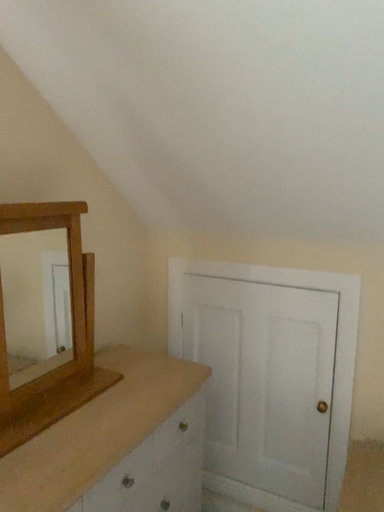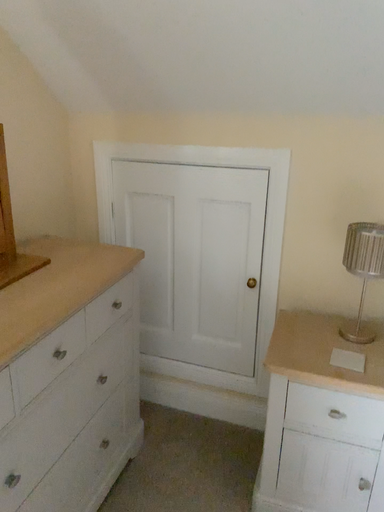
Question: How did the camera likely rotate when shooting the video?

Choices:
 (A) rotated upward
 (B) rotated downward

Answer: (B)